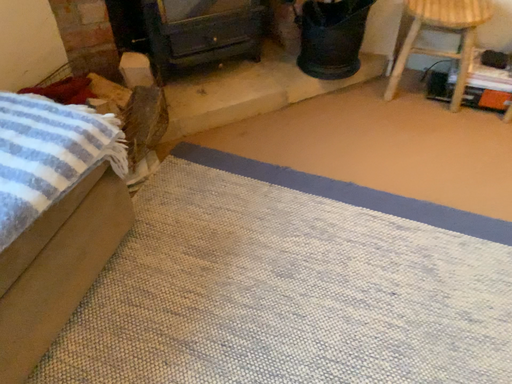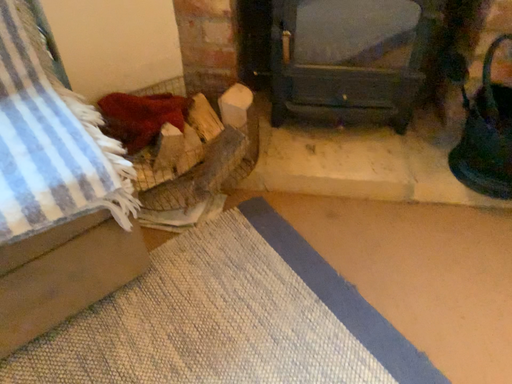
Question: Which way did the camera rotate in the video?

Choices:
 (A) rotated right
 (B) rotated left

Answer: (B)